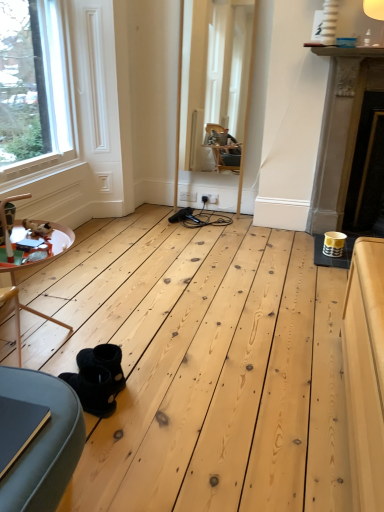
Question: Considering the positions of wooden table at lower left and gold metallic fireplace at right in the image, is wooden table at lower left taller or shorter than gold metallic fireplace at right?

Choices:
 (A) tall
 (B) short

Answer: (B)

Question: Do you think wooden table at lower left is within gold metallic fireplace at right, or outside of it?

Choices:
 (A) inside
 (B) outside

Answer: (B)

Question: Considering the real-world distances, which object is closest to the black suede boots at lower left?

Choices:
 (A) gold metallic fireplace at right
 (B) clear glass window at upper left
 (C) wooden table at lower left

Answer: (C)

Question: Which object is the closest to the clear glass window at upper left?

Choices:
 (A) wooden table at lower left
 (B) gold metallic fireplace at right
 (C) black suede boots at lower left

Answer: (A)